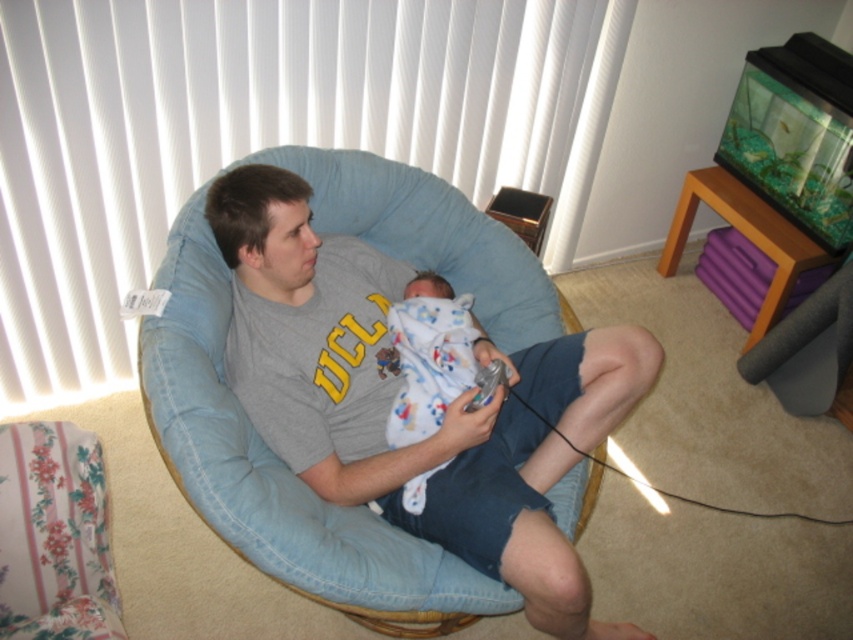
You are a photographer trying to capture a candid shot of the scene. You want to ensure the denim blue chair at center and the white cotton swaddle at center are both in focus. Since you can only focus on one object at a time, which object should you focus on to ensure the other is also in focus due to their spatial arrangement?

The denim blue chair at center is positioned on the right side of white cotton swaddle at center. Therefore, focusing on the denim blue chair at center will also keep the white cotton swaddle at center in focus since they are closely positioned next to each other.

You are a parent trying to place a new baby blanket on the white cotton swaddle at center. The denim blue chair at center is in the way. Can you move the chair to the side to make space?

The denim blue chair at center is below the white cotton swaddle at center, so moving the chair would allow you to access the area beneath the swaddle and create space for placing the new baby blanket.

Based on the photo, you are standing in the room and want to move from point A to point B. The coordinates for point A are point A at (552, 472) and point B are point B at (500, 378). Which point is closer to you?

Point B at (500, 378) is closer to you because it is nearer to the camera than point A at (552, 472).